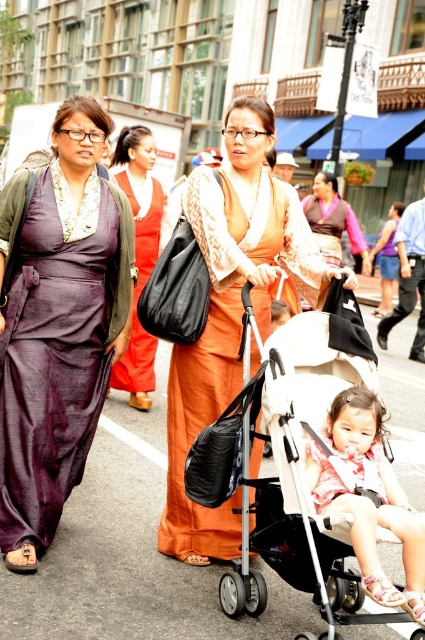
You are a photographer trying to capture a photo of both the white fabric stroller at center and the matte orange dress at center in the same frame. Since the stroller is narrower than the dress, which object should you position closer to the camera to ensure both fit in the frame?

The white fabric stroller at center has a lesser width compared to matte orange dress at center. To ensure both fit in the frame, position the stroller closer to the camera since it is narrower and requires less space in the foreground.

You are a photographer trying to capture both the matte purple dress at left and the purple silk monk at center in a single frame. Given their sizes, which object should you focus on to ensure both fit comfortably in the photo?

The matte purple dress at left is bigger than the purple silk monk at center, so focusing on the matte purple dress at left will ensure both objects fit comfortably in the photo.